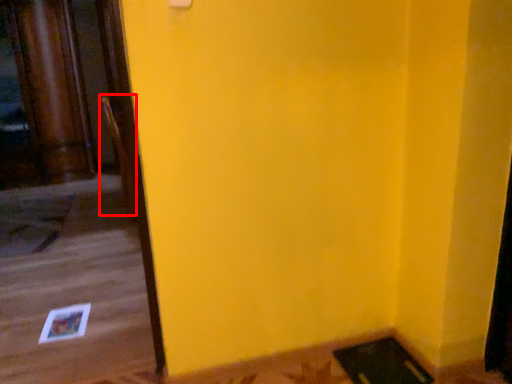
Question: From the image's perspective, what is the correct spatial positioning of chair (annotated by the red box) in reference to doormat?

Choices:
 (A) above
 (B) below

Answer: (A)